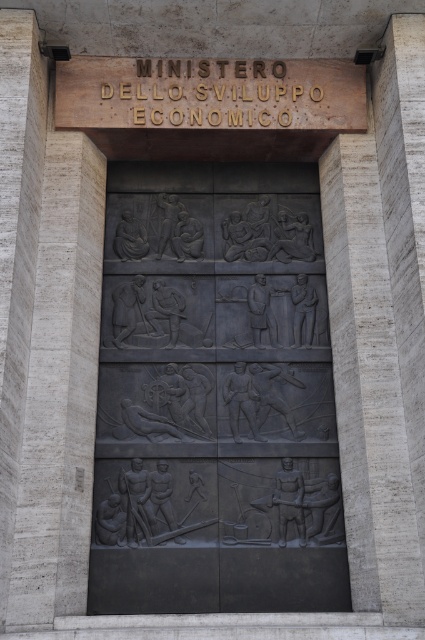
You are a drone operator tasked with capturing aerial footage of the building facade. You need to fly your drone from the point at coordinates point (132,316) to the point at coordinates point (384,81). Based on the scene description, will the drone have a clear path between these two points without any obstructions?

Point (132,316) is behind point (384,81), so the drone will not have a clear path between them because the point at (132,316) is obstructed by the point at (384,81).

You are an architect designing a new building and want to ensure accessibility for visitors. The pathway between the gray stone pillar at right and the gold metallic sign at upper center is 19.88 feet long. If your wheelchair has a turning radius of 24 inches, will there be enough space for the wheelchair to maneuver between these two points?

The distance between the gray stone pillar at right and the gold metallic sign at upper center is 19.88 feet. Since 19.88 feet is approximately 238.56 inches, and the wheelchair requires a turning radius of 24 inches, there is sufficient space for the wheelchair to maneuver between these two points as the distance is more than enough to accommodate the required turning radius.